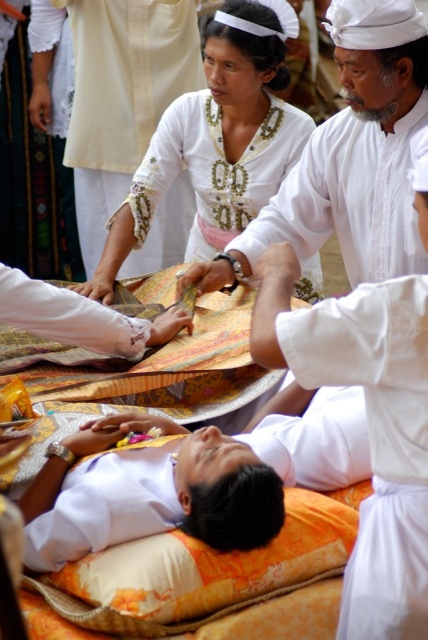
Question: Observing the image, what is the correct spatial positioning of white matte cloth at upper center in reference to white embroidered cloth at center?

Choices:
 (A) right
 (B) left

Answer: (A)

Question: Which is farther from the white matte cloth at upper center?

Choices:
 (A) white cotton robe at lower right
 (B) white embroidered cloth at center
 (C) white woven cloth at upper left
 (D) white embroidered blouse at upper center

Answer: (C)

Question: Is white matte cloth at upper center wider than white embroidered blouse at upper center?

Choices:
 (A) no
 (B) yes

Answer: (A)

Question: Which point is closer to the camera?

Choices:
 (A) (222, 173)
 (B) (168, 83)

Answer: (A)

Question: Can you confirm if white matte cloth at upper center is thinner than white embroidered blouse at upper center?

Choices:
 (A) no
 (B) yes

Answer: (B)

Question: Estimate the real-world distances between objects in this image. Which object is farther from the white woven cloth at upper left?

Choices:
 (A) white cloth at center
 (B) white embroidered cloth at center
 (C) white matte cloth at upper center

Answer: (A)